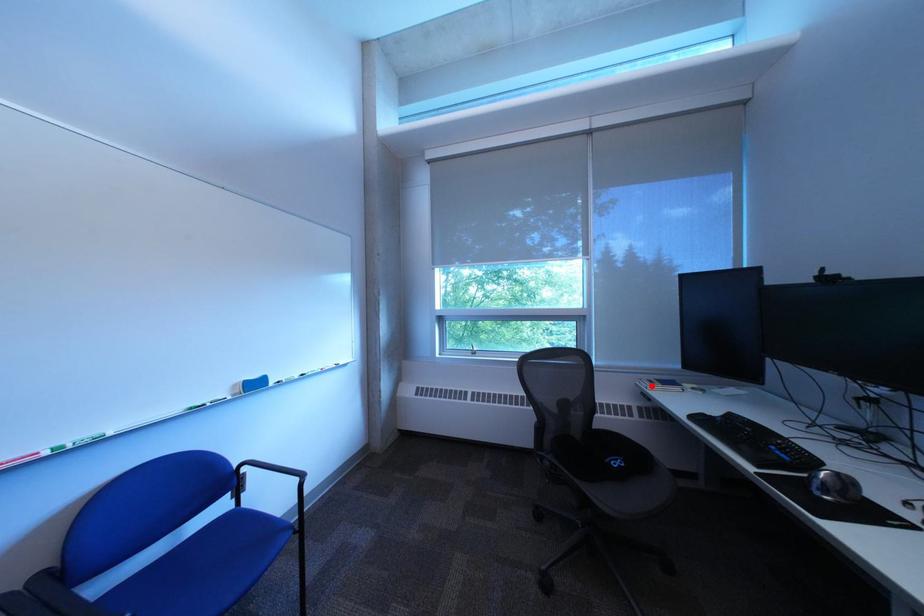
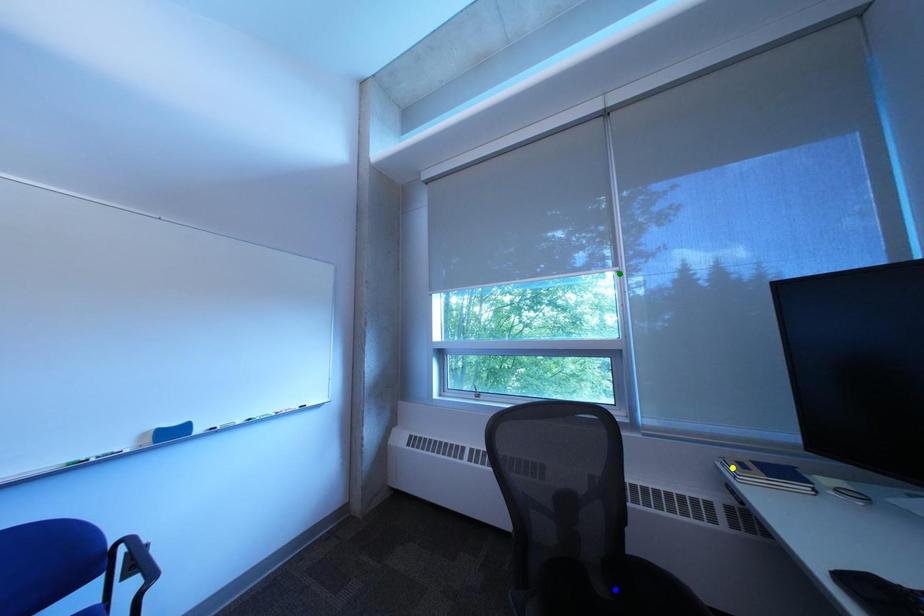
Question: I am providing you with two images of the same scene from different viewpoints. A red point is marked on the first image. You are given multiple points on the second image. Which point in image 2 is actually the same real-world point as the red point in image 1?

Choices:
 (A) blue point
 (B) green point
 (C) yellow point

Answer: (C)